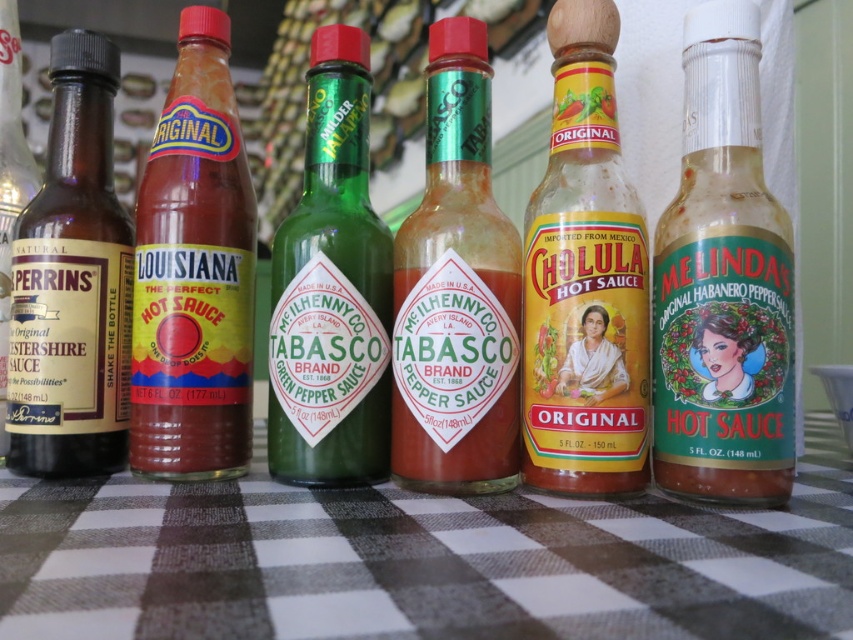
In the scene shown: You are a chef trying to reach the matte plastic hot sauce at center from the edge of the black checkered tablecloth at center. Can you grab it without moving your hand more than 10 inches?

The distance between the black checkered tablecloth at center and the matte plastic hot sauce at center is 10.12 inches, so you cannot reach it without moving your hand more than 10 inches.

From the picture: You are standing 10 feet away from the table with the hot sauce bottles. You want to grab the matte glass bottle at center. Can you reach it without moving your position?

The matte glass bottle at center is 24.74 inches from the viewer. Since 10 feet is approximately 120 inches, you are much farther away than the required distance. You cannot reach it without moving closer.

You are organizing a hot sauce tasting event and need to place a rectangular placard between the matte glass bottle at center and the brown glass bottle at left. The placard is 10 cm wide. Can the placard fit between them without overlapping either bottle?

The matte glass bottle at center is narrower than the brown glass bottle at left. However, the description only provides information about their widths relative to each other, not the exact distance between them. Without knowing the actual space between the bottles, it is impossible to determine if the 10 cm placard will fit without overlapping.